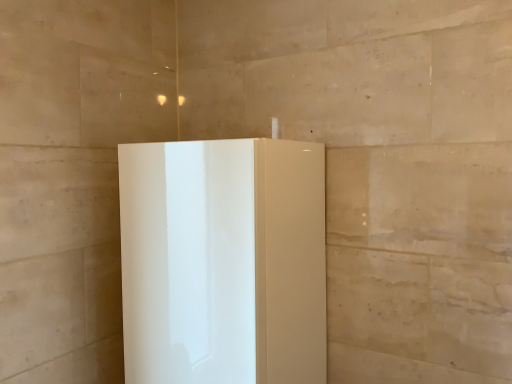
At what (x,y) coordinates should I click in order to perform the action: click on glossy white cabinet at center. Please return your answer as a coordinate pair (x, y). The image size is (512, 384). Looking at the image, I should click on (223, 261).

The image size is (512, 384). Describe the element at coordinates (223, 261) in the screenshot. I see `glossy white cabinet at center` at that location.

At what (x,y) coordinates should I click in order to perform the action: click on glossy white cabinet at center. Please return your answer as a coordinate pair (x, y). The image size is (512, 384). Looking at the image, I should click on (223, 261).